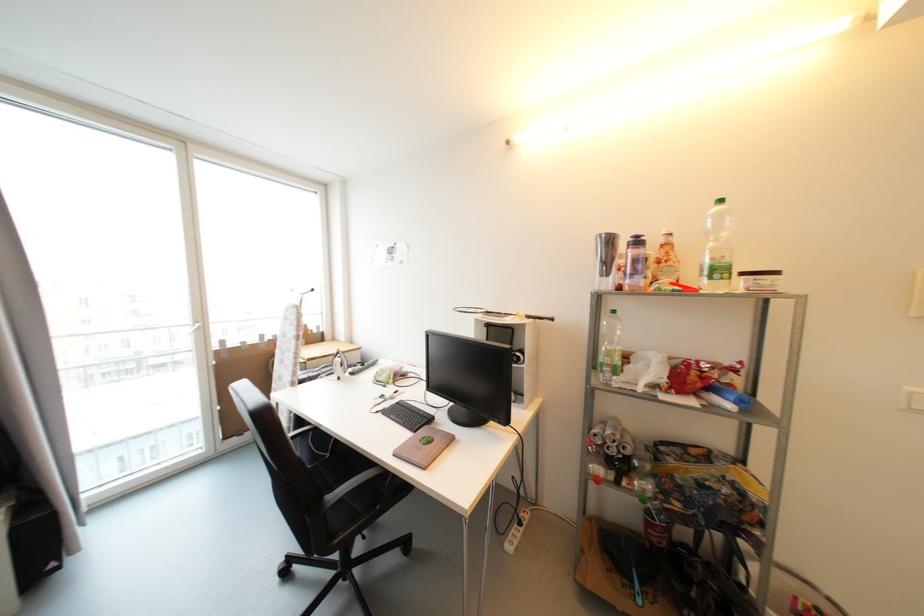
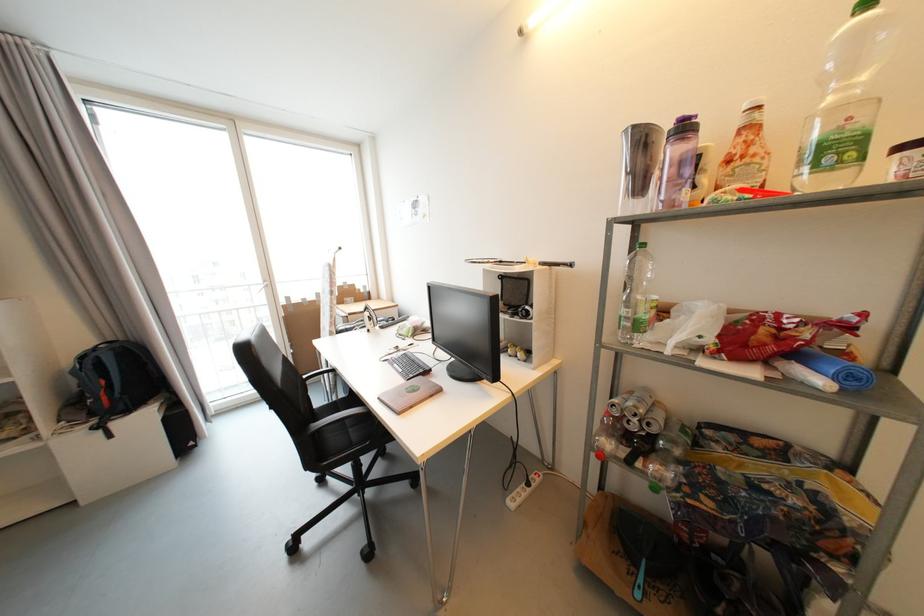
In a continuous first-person perspective shot, in which direction is the camera moving?

The cameraman moved toward right, forward.